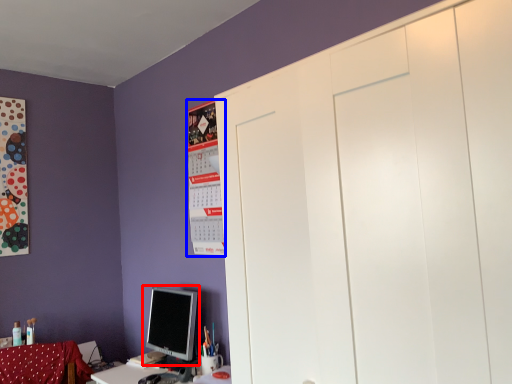
Question: Which object appears farthest to the camera in this image, computer monitor (highlighted by a red box) or bulletin board (highlighted by a blue box)?

Choices:
 (A) computer monitor
 (B) bulletin board

Answer: (B)